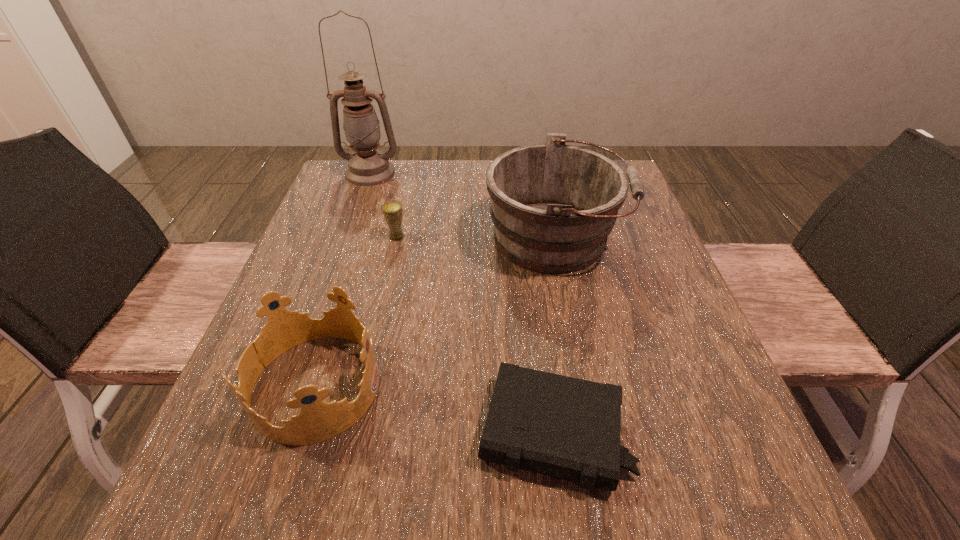
Where is `vacant space that's between the wine bucket and the straw for drinking`? The height and width of the screenshot is (540, 960). vacant space that's between the wine bucket and the straw for drinking is located at coordinates (476, 238).

The image size is (960, 540). I want to click on vacant point located between the farthest object and the Bible, so click(462, 302).

In order to click on object that stands as the fourth closest to the shortest object in this screenshot , I will do pyautogui.click(x=367, y=167).

Identify which object is located as the second nearest to the straw for drinking. Please provide its 2D coordinates. Your answer should be formatted as a tuple, i.e. [(x, y)], where the tuple contains the x and y coordinates of a point satisfying the conditions above.

[(367, 167)]

Locate an element on the screen. Image resolution: width=960 pixels, height=540 pixels. vacant position in the image that satisfies the following two spatial constraints: 1. on the front-facing side of the shortest object; 2. on the right side of the tiara is located at coordinates (300, 432).

You are a GUI agent. You are given a task and a screenshot of the screen. Output one action in this format:
    pyautogui.click(x=<x>, y=<y>)
    Task: Click on the free space that satisfies the following two spatial constraints: 1. on the front side of the straw for drinking; 2. on the front-facing side of the tiara
    
    Given the screenshot: What is the action you would take?
    pyautogui.click(x=364, y=386)

This screenshot has width=960, height=540. What are the coordinates of `vacant space that satisfies the following two spatial constraints: 1. on the front side of the wine bucket; 2. on the left side of the tallest object` in the screenshot? It's located at (348, 238).